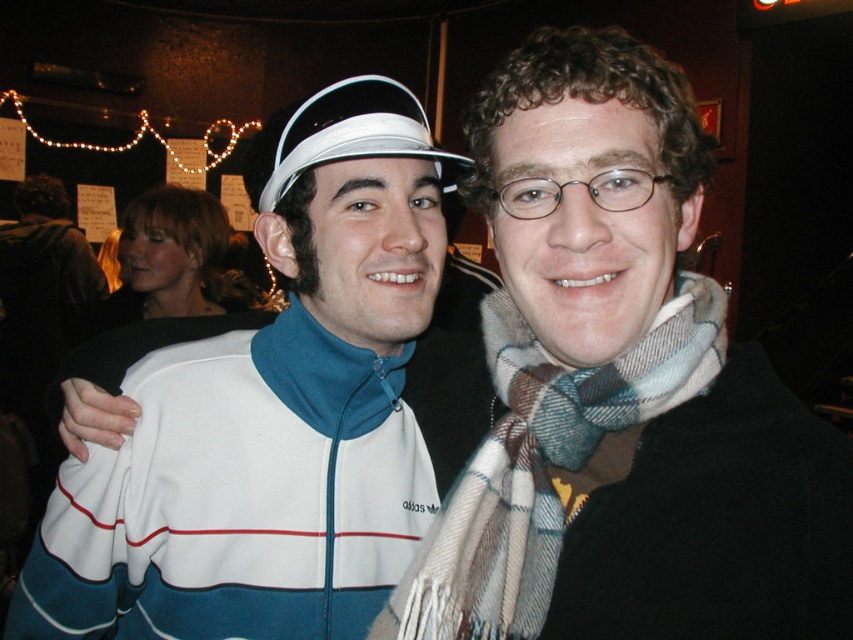
Which of these two, white matte visor at upper center or plaid wool scarf at right, stands shorter?

plaid wool scarf at right

Does white matte visor at upper center appear on the left side of plaid wool scarf at right?

Correct, you'll find white matte visor at upper center to the left of plaid wool scarf at right.

Is point (376, 208) behind point (548, 442)?

That is True.

Locate an element on the screen. The image size is (853, 640). white matte visor at upper center is located at coordinates click(x=271, y=412).

Can you confirm if white matte visor at upper center is positioned below white fabric visor at upper center?

Yes, white matte visor at upper center is below white fabric visor at upper center.

Based on the photo, between white matte visor at upper center and white fabric visor at upper center, which one is positioned higher?

white fabric visor at upper center

Does point (247, 186) come farther from viewer compared to point (270, 202)?

That is True.

Where is `white matte visor at upper center`? white matte visor at upper center is located at coordinates (271, 412).

Does point (506, 504) lie in front of point (375, 96)?

Yes.

Is plaid wool scarf at right to the right of white fabric visor at upper center from the viewer's perspective?

Yes, plaid wool scarf at right is to the right of white fabric visor at upper center.

Does point (537, 544) lie behind point (354, 84)?

No, it is not.

Image resolution: width=853 pixels, height=640 pixels. What are the coordinates of `plaid wool scarf at right` in the screenshot? It's located at tap(541, 465).